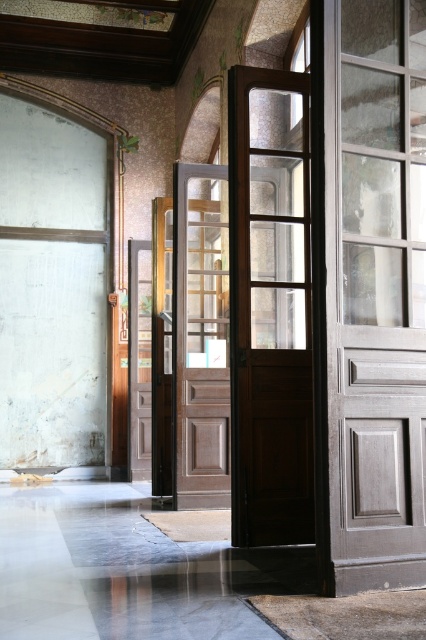
You are standing in the room and want to exit through the closest door. Which door should you choose between the transparent glass door at center and the matte brown wooden door at center?

The transparent glass door at center is closer to the viewer than the matte brown wooden door at center, so you should choose the transparent glass door at center to exit.

You are trying to exit the room through the transparent glass door at center and the matte brown wooden door at center. Which door should you go through if you want to exit to the area that is more open and visible?

The transparent glass door at center is located above matte brown wooden door at center, so exiting through the transparent glass door at center would lead to an area that is more open and visible since glass allows visibility.

You are an interior designer planning to move a large sofa through the transparent glass door at center and the brown wooden door at center. Based on their sizes, which door would you choose to ensure the sofa can pass through?

The transparent glass door at center occupies less space than the brown wooden door at center, so the brown wooden door at center is wider and can accommodate the large sofa more easily.